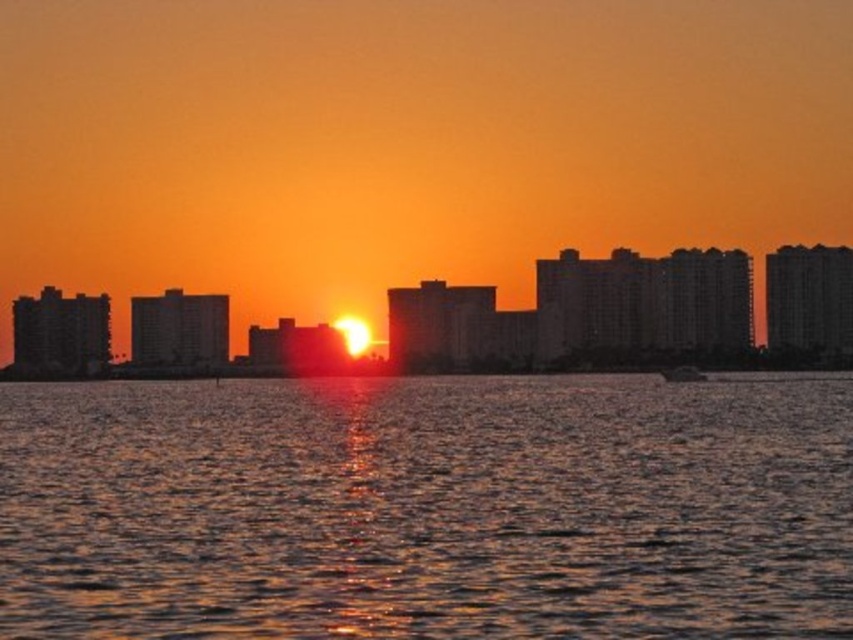
From the picture: You are an artist trying to paint the sunset scene. You notice two types of water surfaces in the image. Which one is larger in size between the glistening water at center and the silky water at center?

The glistening water at center is bigger than the silky water at center, so the glistening water at center is larger in size.

You are an artist trying to paint the sunset scene. You want to ensure the metallic silver boat at center is fully visible in your painting. Given that the silky water at center takes up more space, how should you adjust the boat depiction to maintain its visibility?

Since the silky water at center is larger than the metallic silver boat at center, you should make the boat more detailed or use contrasting colors to ensure it stands out against the expansive water area.